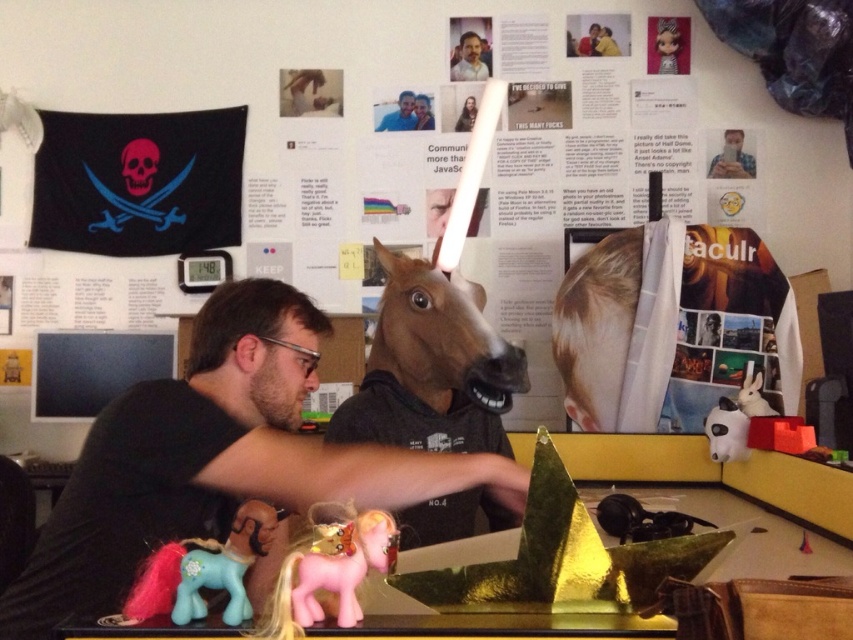
What is located at the coordinates point (216, 458)?

The black matte shirt at center is located at point (216, 458).

You are trying to determine which object is taller between the brown matte horse head at center and the matte black shirt at center. Based on the scene described, which one is taller?

The brown matte horse head at center is taller than the matte black shirt at center according to the description.

You are organizing a desk and need to place the black matte shirt at center and the pastel pink plastic pony at lower left. According to the image, which object is more to the left?

The pastel pink plastic pony at lower left is more to the left than the black matte shirt at center.